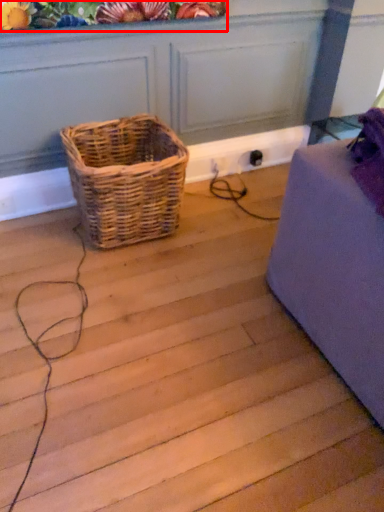
Question: From the image's perspective, what is the correct spatial relationship of floral arrangement (annotated by the red box) in relation to picnic basket?

Choices:
 (A) above
 (B) below

Answer: (A)